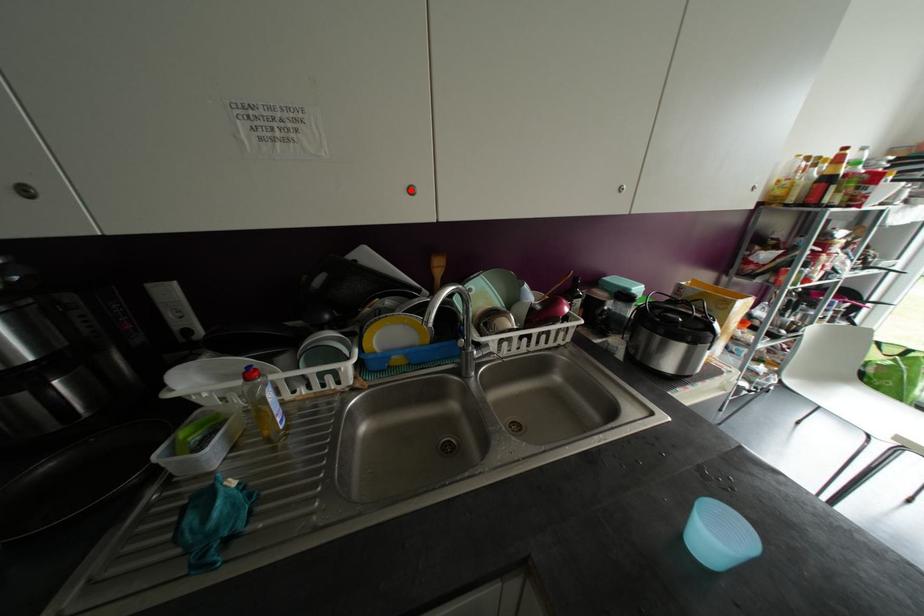
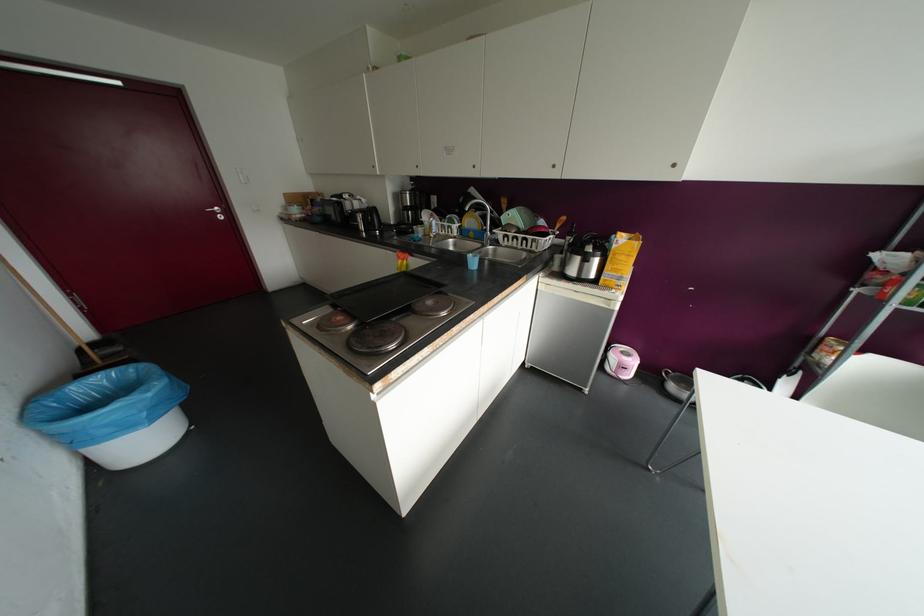
Question: A red point is marked in image1. In image2, is the corresponding 3D point closer to the camera or farther? Reply with the corresponding letter.

Choices:
 (A) The corresponding 3D point is closer.
 (B) The corresponding 3D point is farther.

Answer: (A)